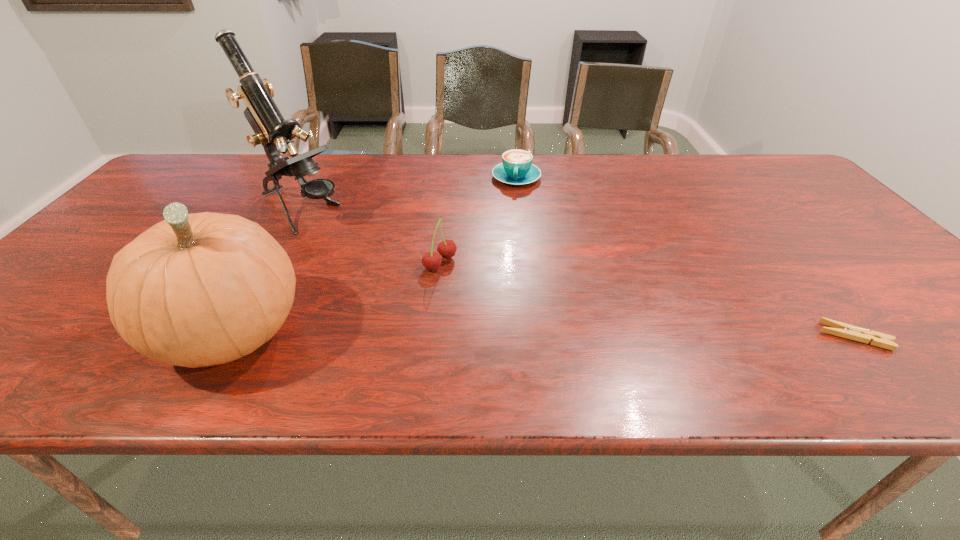
This screenshot has height=540, width=960. Identify the location of pumpkin. (194, 290).

The width and height of the screenshot is (960, 540). Identify the location of the shortest object. (840, 329).

Where is `clothespin`? The width and height of the screenshot is (960, 540). clothespin is located at coordinates (840, 329).

The height and width of the screenshot is (540, 960). I want to click on the tallest object, so click(x=271, y=130).

What are the coordinates of `the fourth tallest object` in the screenshot? It's located at (516, 168).

Locate an element on the screen. the second object from right to left is located at coordinates (516, 168).

At what (x,y) coordinates should I click in order to perform the action: click on the third shortest object. Please return your answer as a coordinate pair (x, y). The width and height of the screenshot is (960, 540). Looking at the image, I should click on (431, 261).

You are a GUI agent. You are given a task and a screenshot of the screen. Output one action in this format:
    pyautogui.click(x=<x>, y=<y>)
    Task: Click on the third object from left to right
    
    Given the screenshot: What is the action you would take?
    pyautogui.click(x=431, y=261)

Find the location of `vacant area located on the left of the rightmost object`. vacant area located on the left of the rightmost object is located at coordinates (763, 336).

Where is `free space located 0.090m through the eyepiece of the microscope`? free space located 0.090m through the eyepiece of the microscope is located at coordinates (352, 239).